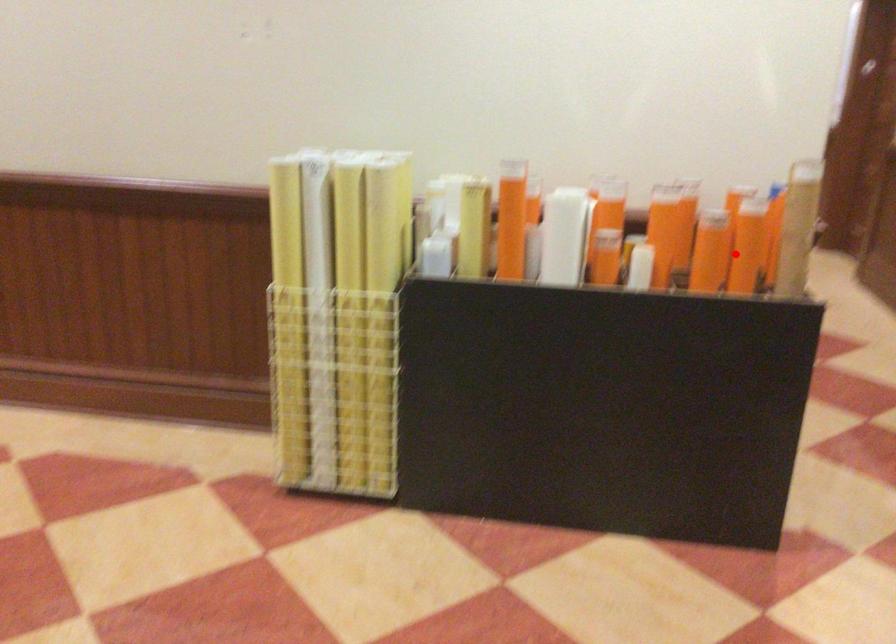
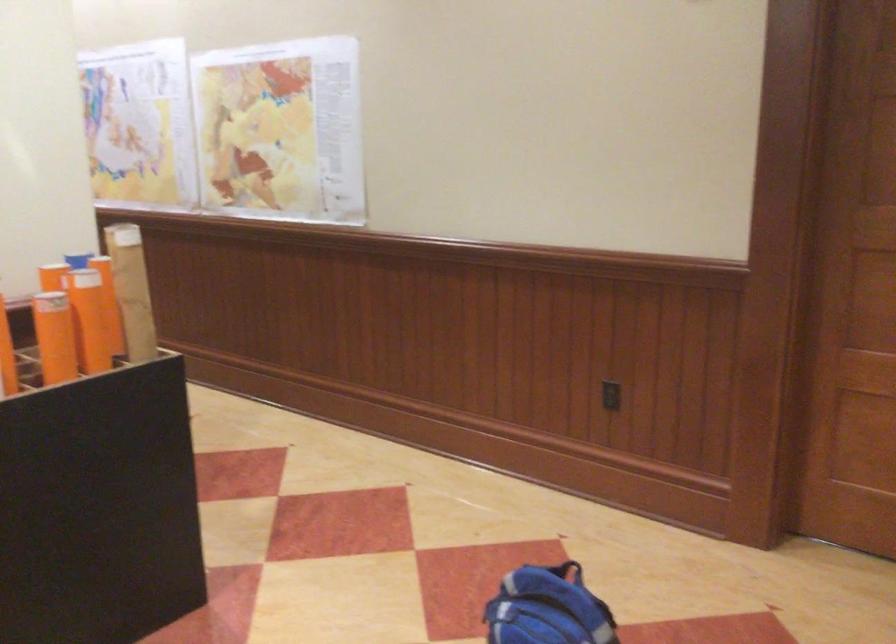
Locate, in the second image, the point that corresponds to the highlighted location in the first image.

(99, 330)